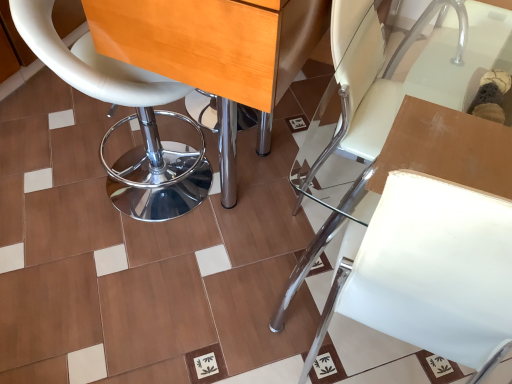
In order to click on vacant space positioned to the left of white leather chair at center, placed as the 2th chair when sorted from left to right in this screenshot , I will do `click(167, 275)`.